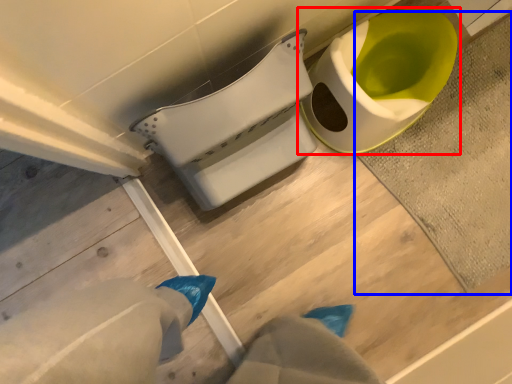
Question: Which object is closer to the camera taking this photo, toilet (highlighted by a red box) or bath mat (highlighted by a blue box)?

Choices:
 (A) toilet
 (B) bath mat

Answer: (A)